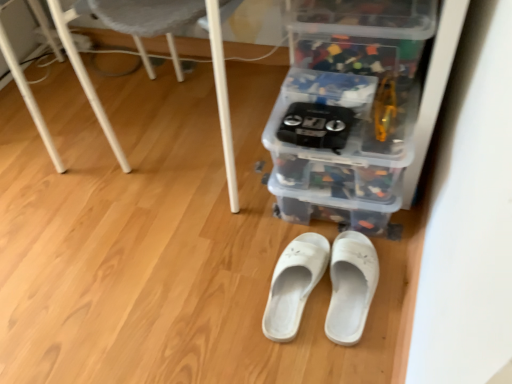
Where is `free space in front of white plastic chair at lower center`? The width and height of the screenshot is (512, 384). free space in front of white plastic chair at lower center is located at coordinates (167, 260).